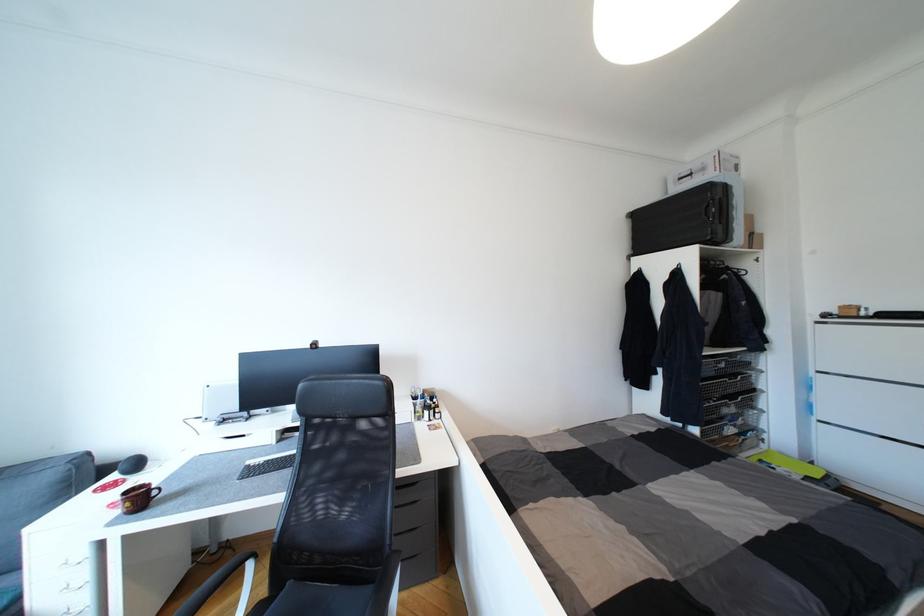
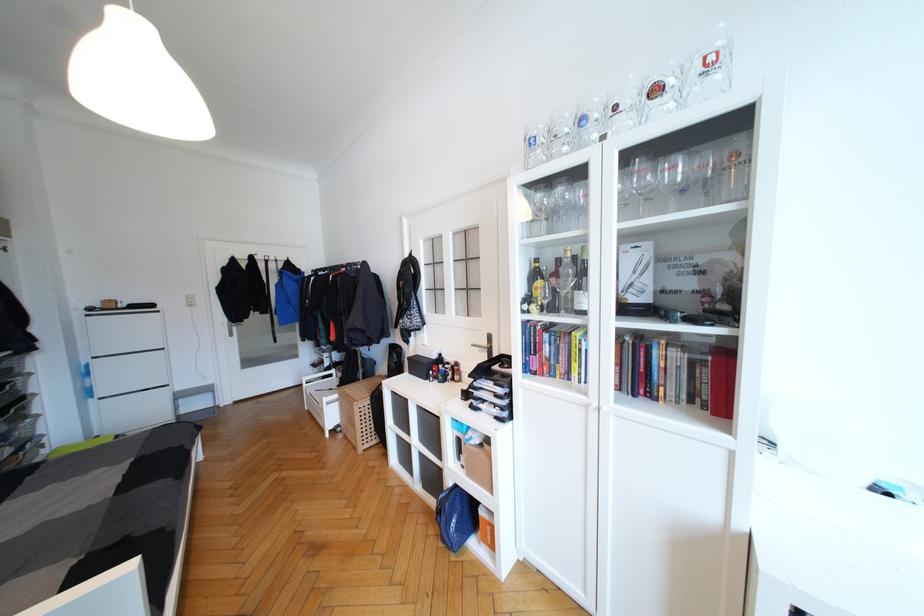
Question: How did the camera likely rotate?

Choices:
 (A) Left
 (B) Right
 (C) Up
 (D) Down

Answer: (B)